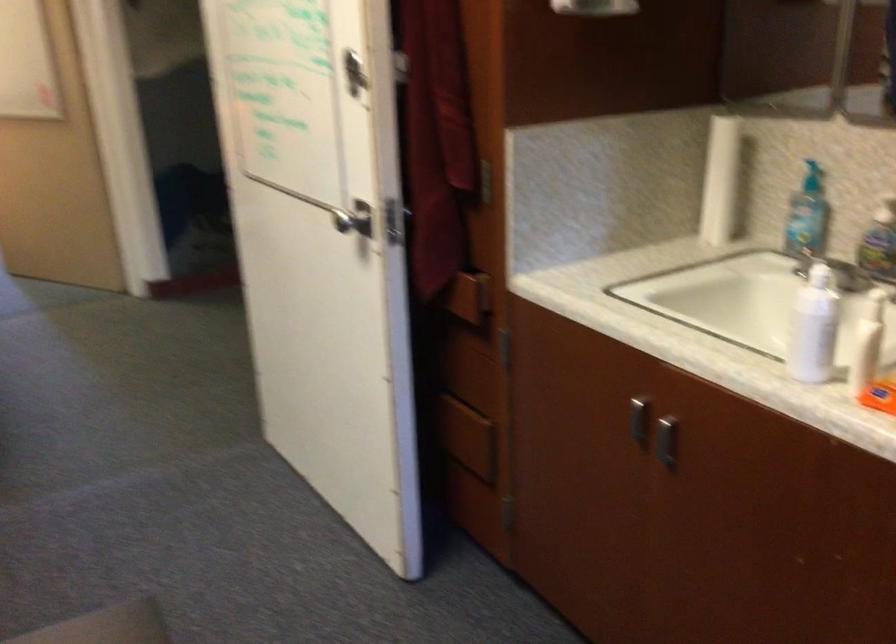
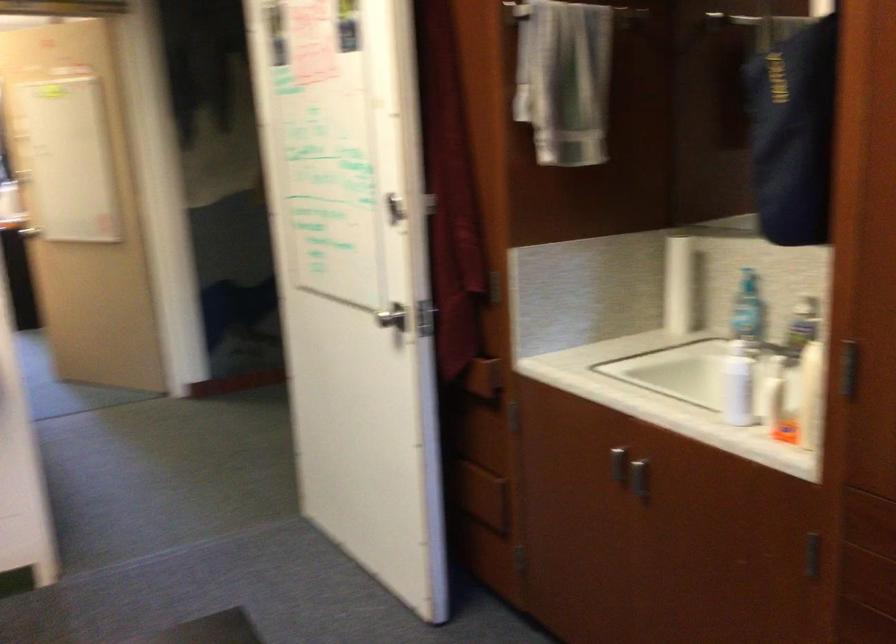
In the second image, find the point that corresponds to pixel 351 220 in the first image.

(391, 317)